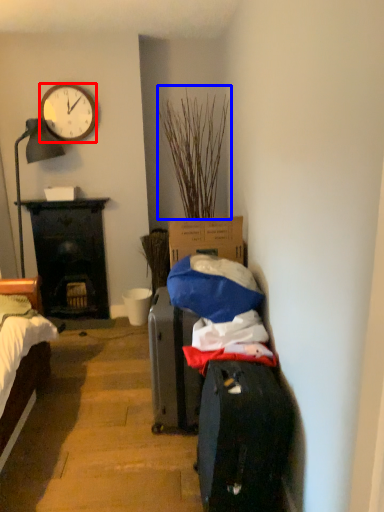
Question: Which object appears farthest to the camera in this image, clock (highlighted by a red box) or plant (highlighted by a blue box)?

Choices:
 (A) clock
 (B) plant

Answer: (A)